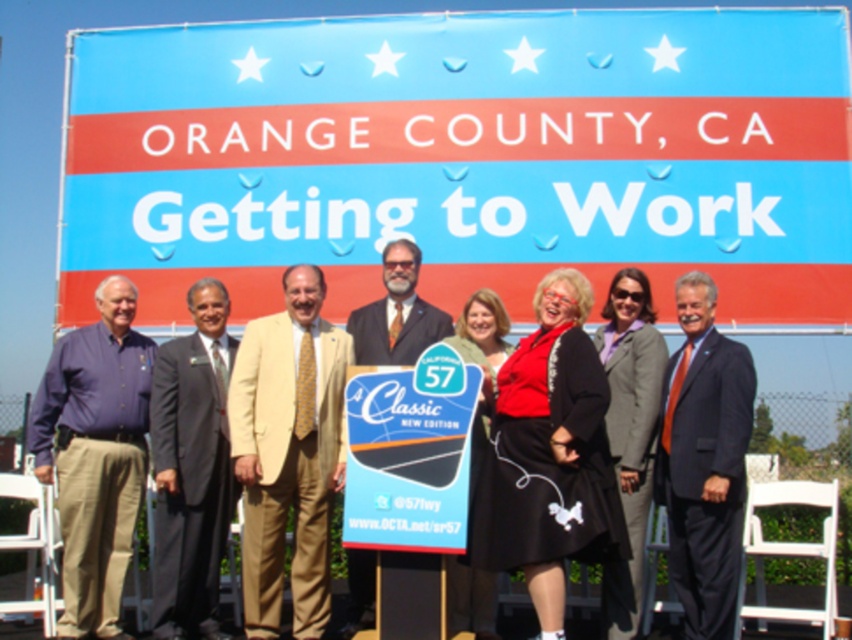
Question: Which object is the closest to the matte blue shirt at left?

Choices:
 (A) blue fabric sign at upper center
 (B) dark blue suit at center
 (C) blue plastic sign at center

Answer: (A)

Question: Among these points, which one is farthest from the camera?

Choices:
 (A) (412, 467)
 (B) (268, 92)
 (C) (49, 388)
 (D) (318, 358)

Answer: (B)

Question: From the image, what is the correct spatial relationship of light beige suit at center in relation to dark gray suit at center?

Choices:
 (A) right
 (B) left

Answer: (A)

Question: Which point is farther to the camera?

Choices:
 (A) matte blue shirt at left
 (B) dark blue suit at center

Answer: (A)

Question: Is dark blue suit at center below blue plastic sign at center?

Choices:
 (A) yes
 (B) no

Answer: (A)

Question: Is matte blue shirt at left positioned before dark blue suit at center?

Choices:
 (A) yes
 (B) no

Answer: (B)